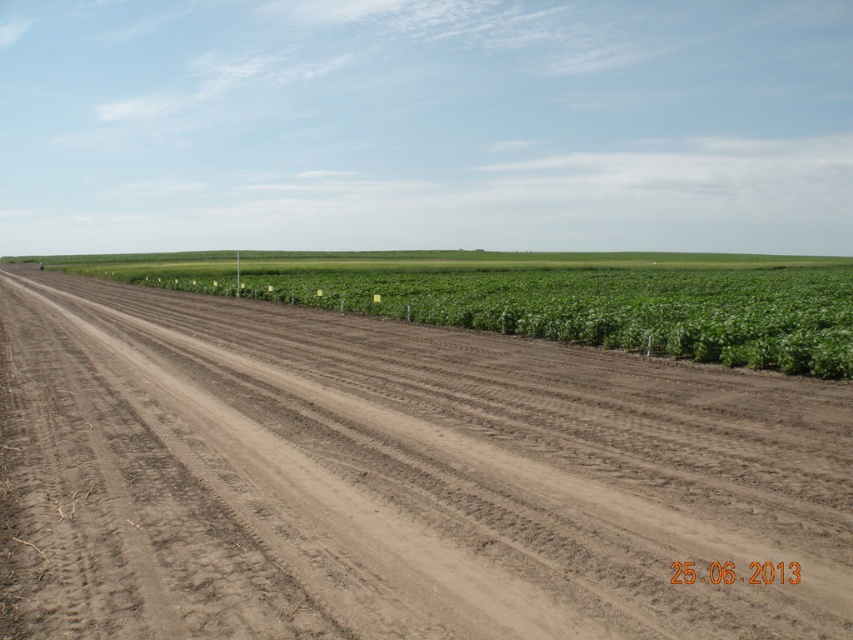
You are a farmer checking the crops. You see the brown soil at center and the green leafy plant at center. Which one is more to the right?

The brown soil at center is positioned on the right side of green leafy plant at center, so the brown soil at center is more to the right.

You are a farmer inspecting your crops. You notice the brown soil at center and the green leafy plant at center. Which one has a greater height?

The green leafy plant at center is taller than the brown soil at center.

You are a farmer checking the growth of your crops. You notice the brown soil at center and the green leafy plant at center in your field. Which one has a smaller width?

The brown soil at center is thinner than the green leafy plant at center, so the brown soil at center has a smaller width.